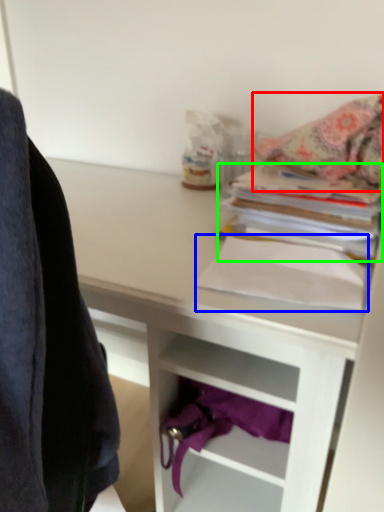
Question: Based on their relative distances, which object is nearer to blanket (highlighted by a red box)? Choose from paperback book (highlighted by a blue box) and paperback book (highlighted by a green box).

Choices:
 (A) paperback book
 (B) paperback book

Answer: (B)